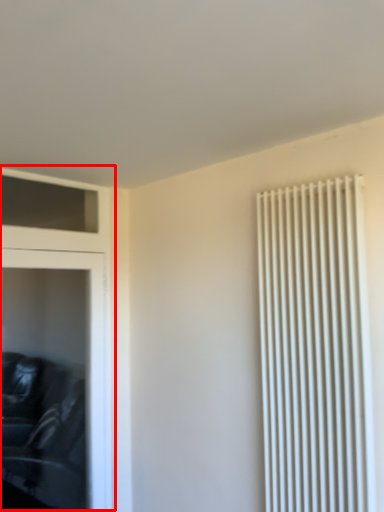
Question: From the image's perspective, considering the relative positions of dresser (annotated by the red box) and radiator in the image provided, where is dresser (annotated by the red box) located with respect to the staircase?

Choices:
 (A) below
 (B) above

Answer: (A)